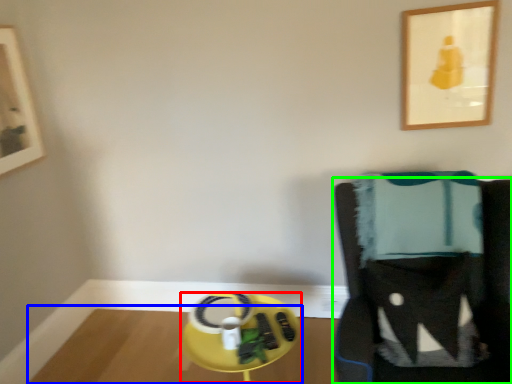
Question: Considering the real-world distances, which object is closest to round table (highlighted by a red box)? table (highlighted by a blue box) or furniture (highlighted by a green box).

Choices:
 (A) table
 (B) furniture

Answer: (B)